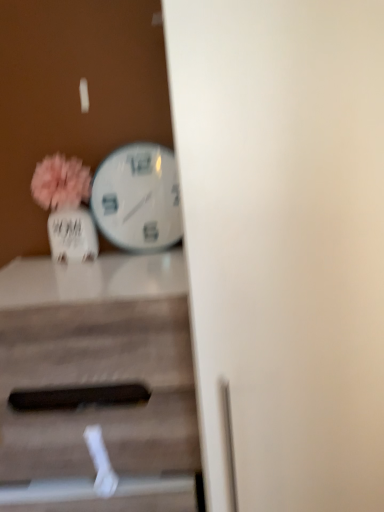
Question: From a real-world perspective, is white glossy wall clock at center-left positioned under matte white vase at left based on gravity?

Choices:
 (A) yes
 (B) no

Answer: (B)

Question: Is the position of white glossy wall clock at center-left more distant than that of matte white vase at left?

Choices:
 (A) no
 (B) yes

Answer: (B)

Question: Considering the relative sizes of white glossy wall clock at center-left and matte white vase at left in the image provided, is white glossy wall clock at center-left wider than matte white vase at left?

Choices:
 (A) no
 (B) yes

Answer: (A)

Question: Is white glossy wall clock at center-left positioned before matte white vase at left?

Choices:
 (A) no
 (B) yes

Answer: (A)

Question: Can you confirm if white glossy wall clock at center-left is thinner than matte white vase at left?

Choices:
 (A) no
 (B) yes

Answer: (B)

Question: Is white glossy wall clock at center-left looking in the opposite direction of matte white vase at left?

Choices:
 (A) yes
 (B) no

Answer: (B)

Question: Considering the relative positions of matte white vase at left and wooden table at center in the image provided, is matte white vase at left to the left of wooden table at center from the viewer's perspective?

Choices:
 (A) yes
 (B) no

Answer: (A)

Question: Is matte white vase at left smaller than wooden table at center?

Choices:
 (A) yes
 (B) no

Answer: (A)

Question: Does matte white vase at left have a larger size compared to wooden table at center?

Choices:
 (A) no
 (B) yes

Answer: (A)

Question: Is matte white vase at left outside of wooden table at center?

Choices:
 (A) no
 (B) yes

Answer: (B)

Question: Is matte white vase at left surrounding wooden table at center?

Choices:
 (A) yes
 (B) no

Answer: (B)

Question: From a real-world perspective, is matte white vase at left physically above wooden table at center?

Choices:
 (A) no
 (B) yes

Answer: (B)

Question: Is wooden table at center outside of matte white vase at left?

Choices:
 (A) no
 (B) yes

Answer: (B)